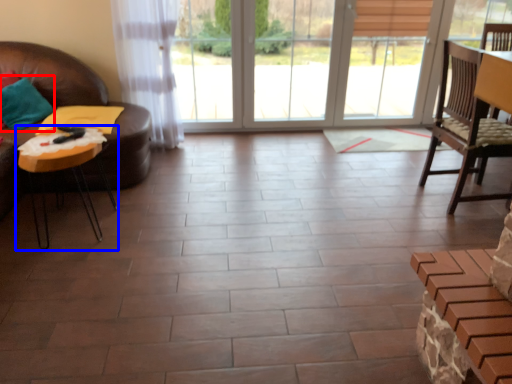
Question: Among these objects, which one is nearest to the camera, pillow (highlighted by a red box) or table (highlighted by a blue box)?

Choices:
 (A) pillow
 (B) table

Answer: (B)